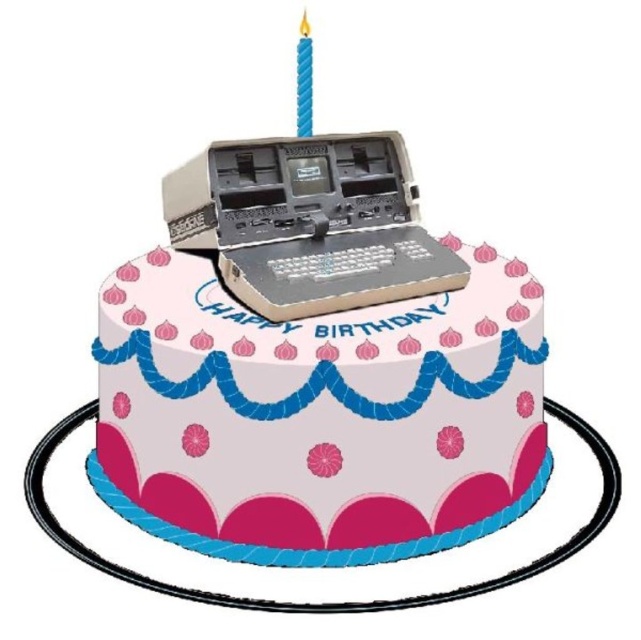
Question: From the image, what is the correct spatial relationship of white matte cake at center in relation to blue wax candle at upper center?

Choices:
 (A) left
 (B) right

Answer: (B)

Question: Based on their relative distances, which object is farther from the white matte cake at center?

Choices:
 (A) blue wax candle at upper center
 (B) beige plastic register at center

Answer: (A)

Question: Does white matte cake at center have a lesser width compared to blue wax candle at upper center?

Choices:
 (A) no
 (B) yes

Answer: (A)

Question: Which point appears closest to the camera in this image?

Choices:
 (A) (301, 72)
 (B) (228, 456)

Answer: (B)

Question: Is white matte cake at center bigger than beige plastic register at center?

Choices:
 (A) yes
 (B) no

Answer: (A)

Question: Which object is farther from the camera taking this photo?

Choices:
 (A) blue wax candle at upper center
 (B) beige plastic register at center

Answer: (A)